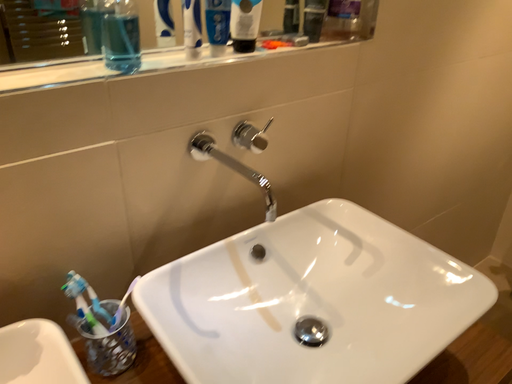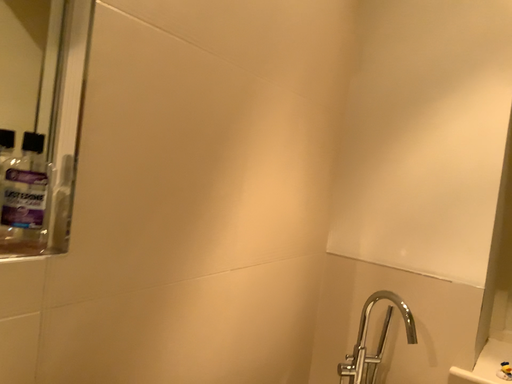
Question: How did the camera likely rotate when shooting the video?

Choices:
 (A) rotated upward
 (B) rotated downward

Answer: (A)